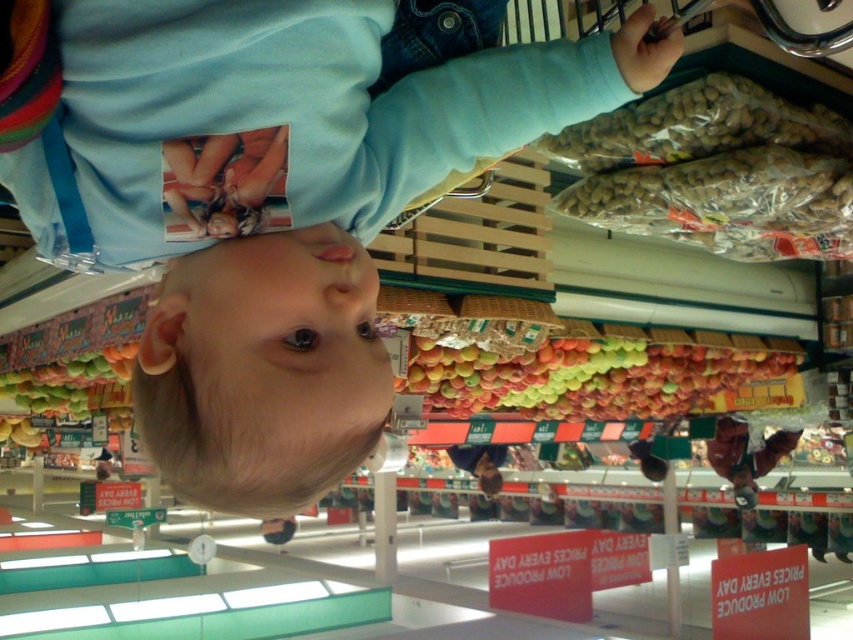
You are a customer in the grocery store looking at the produce section from an upside down perspective. You see the point labeled as point (283, 113). What object is located at this coordinate?

The point (283, 113) indicates the location of the blue cotton sweatshirt at upper center.

You are a customer in the grocery store and you want to find the blue cotton sweatshirt at upper center. According to the store layout, where should you look relative to the shelves and the child?

The blue cotton sweatshirt at upper center is located at coordinates point (283, 113), which is near the upper center area of the image. Since the image is upside down, this position would actually be towards the lower part of the physical store layout. Therefore, you should look below the shelves and the child to find it.